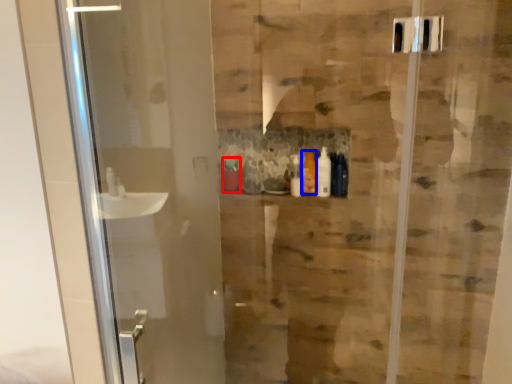
Question: Which object is closer to the camera taking this photo, toiletry (highlighted by a red box) or toiletry (highlighted by a blue box)?

Choices:
 (A) toiletry
 (B) toiletry

Answer: (B)